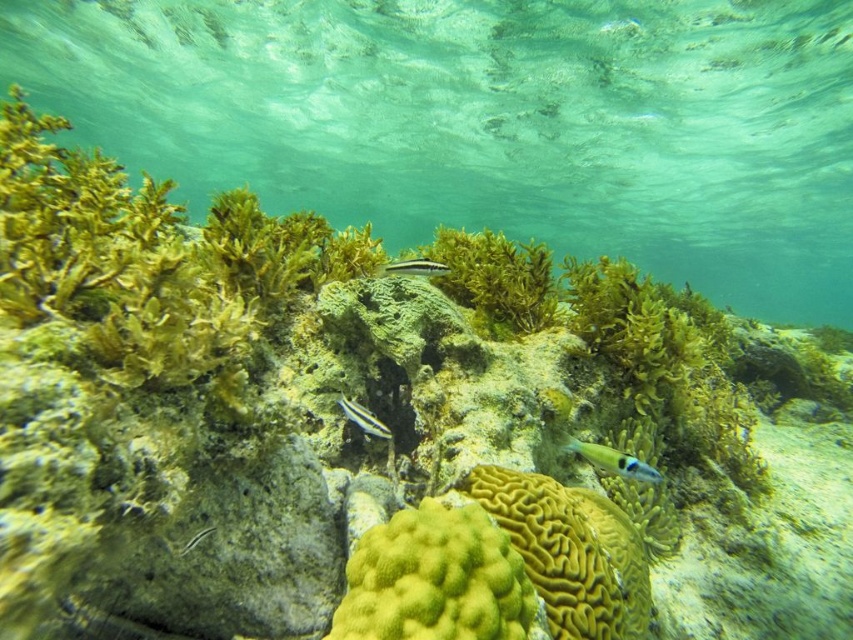
Does yellow coral at center come behind green matte algae at center?

No, yellow coral at center is closer to the viewer.

Who is more distant from viewer, [421,504] or [512,294]?

The point [512,294] is more distant.

What do you see at coordinates (434, 579) in the screenshot?
I see `yellow coral at center` at bounding box center [434, 579].

You are a GUI agent. You are given a task and a screenshot of the screen. Output one action in this format:
    pyautogui.click(x=<x>, y=<y>)
    Task: Click on the yellow coral at center
    The image size is (853, 640).
    Given the screenshot: What is the action you would take?
    pyautogui.click(x=434, y=579)

Is yellow brain coral at center below shiny silver fish at center?

Yes, yellow brain coral at center is below shiny silver fish at center.

Locate an element on the screen. This screenshot has width=853, height=640. yellow brain coral at center is located at coordinates (569, 552).

Is point (496, 470) closer to viewer compared to point (433, 272)?

Yes.

I want to click on yellow brain coral at center, so click(569, 552).

Is point (608, 448) closer to camera compared to point (410, 266)?

Yes, it is in front of point (410, 266).

The width and height of the screenshot is (853, 640). What are the coordinates of `translucent blue fish at center` in the screenshot? It's located at (612, 460).

Image resolution: width=853 pixels, height=640 pixels. I want to click on translucent blue fish at center, so click(612, 460).